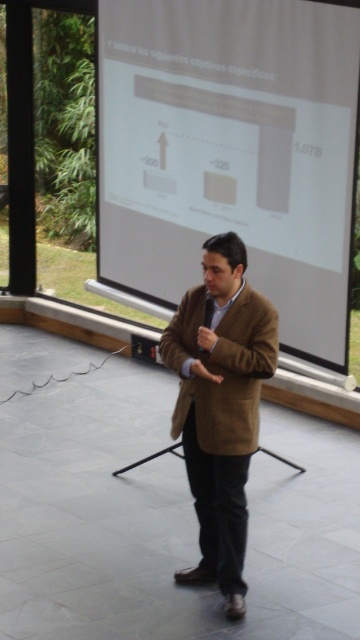
You are a presenter who needs to adjust the position of your projector to ensure the image is centered on the white matte projection screen at center. According to the coordinates provided, where should you position the projector relative to the screen?

The white matte projection screen at center is located at point 0.237 on the x axis and 0.644 on the y axis. To center the projector, align it so that it faces the screen directly at those coordinates.

In the scene shown: You are an event planner standing at the front of the room. You need to hand a document to the presenter who is wearing the brown woolen coat at center. The document is on a table 5 meters away from you. Can you reach the presenter without moving from your current position?

The brown woolen coat at center is 4.70 meters away from the viewer. Since the document is on a table 5 meters away, the presenter is closer than the table. Therefore, you can reach the presenter by extending your arm or using another method without needing to move from your current position.